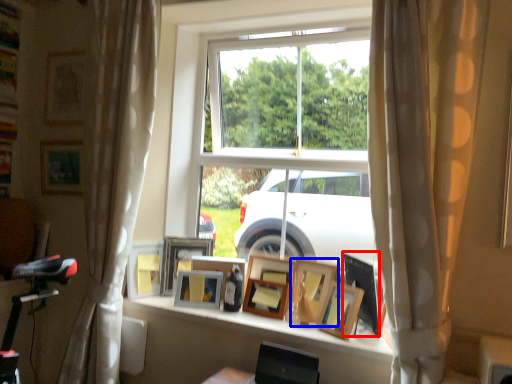
Question: Among these objects, which one is farthest to the camera, picture frame (highlighted by a red box) or picture frame (highlighted by a blue box)?

Choices:
 (A) picture frame
 (B) picture frame

Answer: (B)